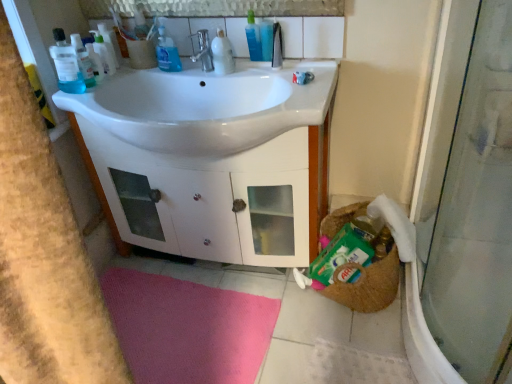
Question: Does point (169, 41) appear closer or farther from the camera than point (266, 84)?

Choices:
 (A) farther
 (B) closer

Answer: (A)

Question: From a real-world perspective, is blue liquid soap at upper center, which is the 2th cleaning product from right to left, positioned above or below white glossy sink at center?

Choices:
 (A) below
 (B) above

Answer: (B)

Question: Which object is the closest to the white glossy bottle at upper center, placed as the 1th cleaning product when sorted from right to left?

Choices:
 (A) white glossy cabinet at center
 (B) satin nickel faucet at center
 (C) translucent plastic bottle at upper center
 (D) blue liquid soap at upper center, which is the 2th cleaning product from right to left
 (E) white glossy sink at center

Answer: (B)

Question: Which object is positioned farthest from the white glossy bottle at upper center, acting as the 2th cleaning product starting from the left?

Choices:
 (A) blue liquid soap at upper center, which is the 1th cleaning product from left to right
 (B) translucent plastic bottle at upper center
 (C) white glossy cabinet at center
 (D) satin nickel faucet at center
 (E) white glossy sink at center

Answer: (C)